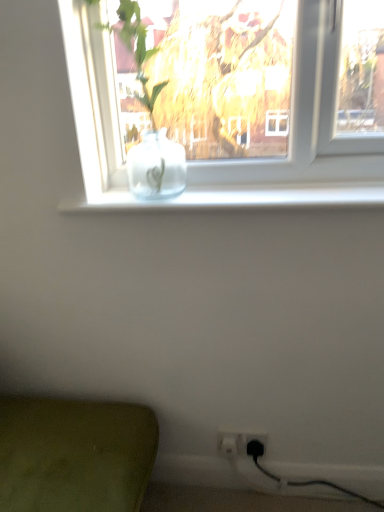
Question: From a real-world perspective, is white plastic electric outlet at lower right, arranged as the 1th electric outlet when viewed from the left, above or below white plastic electric outlet at lower right, which is the second electric outlet in left-to-right order?

Choices:
 (A) above
 (B) below

Answer: (A)

Question: Is point (264, 437) positioned closer to the camera than point (256, 441)?

Choices:
 (A) closer
 (B) farther

Answer: (A)

Question: Would you say white plastic electric outlet at lower right, arranged as the 1th electric outlet when viewed from the left, is inside or outside white plastic electric outlet at lower right, which is the second electric outlet in left-to-right order?

Choices:
 (A) inside
 (B) outside

Answer: (B)

Question: In the image, is white plastic electric outlet at lower right, which is the second electric outlet in left-to-right order, positioned in front of or behind white plastic electric outlet at lower right, arranged as the 1th electric outlet when viewed from the left?

Choices:
 (A) front
 (B) behind

Answer: (A)

Question: Is white plastic electric outlet at lower right, marked as the 1th electric outlet in a right-to-left arrangement, spatially inside white plastic electric outlet at lower right, which appears as the second electric outlet when viewed from the right, or outside of it?

Choices:
 (A) inside
 (B) outside

Answer: (A)

Question: Would you say white plastic electric outlet at lower right, marked as the 1th electric outlet in a right-to-left arrangement, is to the left or to the right of white plastic electric outlet at lower right, arranged as the 1th electric outlet when viewed from the left, in the picture?

Choices:
 (A) right
 (B) left

Answer: (A)

Question: From a real-world perspective, relative to white plastic electric outlet at lower right, arranged as the 1th electric outlet when viewed from the left, is white plastic electric outlet at lower right, which is the second electric outlet in left-to-right order, vertically above or below?

Choices:
 (A) above
 (B) below

Answer: (B)